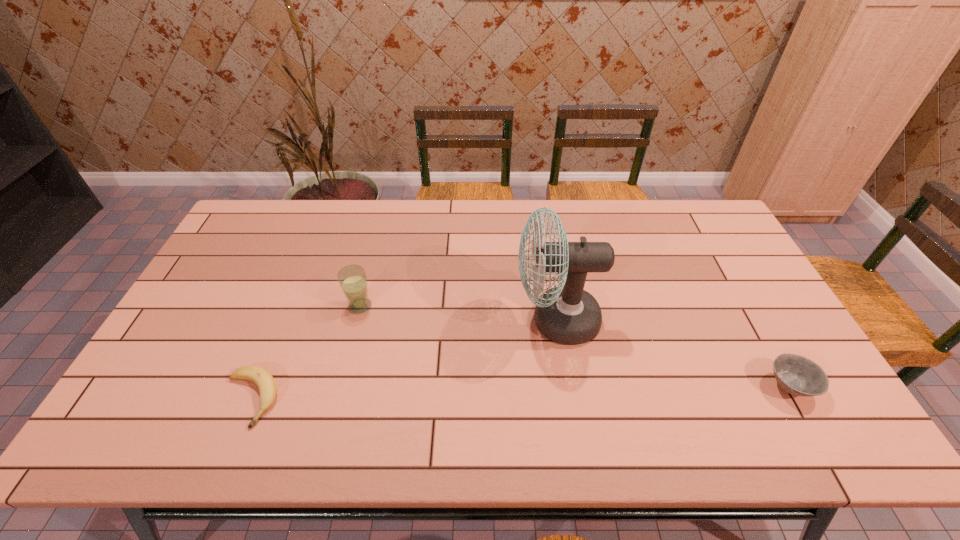
Find the location of `vacant space at the far left corner`. vacant space at the far left corner is located at coordinates (284, 208).

The image size is (960, 540). In the image, there is a desktop. Find the location of `vacant space at the near left corner`. vacant space at the near left corner is located at coordinates (156, 423).

Identify the location of vacant point at the far right corner. This screenshot has width=960, height=540. (703, 210).

The width and height of the screenshot is (960, 540). In order to click on empty space that is in between the tallest object and the second shortest object in this screenshot , I will do `click(673, 354)`.

Where is `vacant area between the second shortest object and the banana`? This screenshot has height=540, width=960. vacant area between the second shortest object and the banana is located at coordinates (519, 393).

Locate an element on the screen. vacant area that lies between the second shortest object and the glass is located at coordinates (575, 346).

Where is `free point between the tallest object and the bowl`? The height and width of the screenshot is (540, 960). free point between the tallest object and the bowl is located at coordinates (673, 354).

You are a GUI agent. You are given a task and a screenshot of the screen. Output one action in this format:
    pyautogui.click(x=<x>, y=<y>)
    Task: Click on the vacant space that's between the second shortest object and the second object from left to right
    
    Given the screenshot: What is the action you would take?
    (x=575, y=346)

Where is `vacant space in between the banana and the second shortest object`? Image resolution: width=960 pixels, height=540 pixels. vacant space in between the banana and the second shortest object is located at coordinates (519, 393).

This screenshot has height=540, width=960. I want to click on empty location between the second tallest object and the tallest object, so click(x=458, y=313).